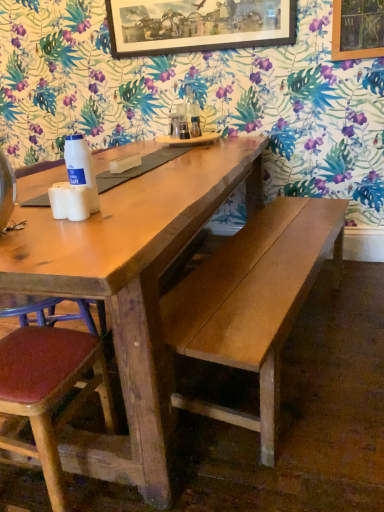
Question: In the image, is white matte salt shaker at left on the left side or the right side of wooden tray at center?

Choices:
 (A) left
 (B) right

Answer: (A)

Question: Is white matte salt shaker at left taller or shorter than wooden tray at center?

Choices:
 (A) tall
 (B) short

Answer: (A)

Question: Which object is the closest to the wooden framed artwork at upper center?

Choices:
 (A) white matte salt shaker at left
 (B) brown wood chair at lower left
 (C) wooden tray at center
 (D) wooden bench at center

Answer: (C)

Question: Based on their relative distances, which object is farther from the wooden tray at center?

Choices:
 (A) wooden framed artwork at upper center
 (B) white matte salt shaker at left
 (C) brown wood chair at lower left
 (D) wooden bench at center

Answer: (C)